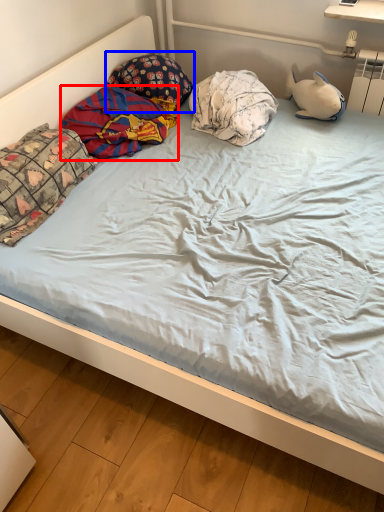
Question: Which of the following is the farthest to the observer, material (highlighted by a red box) or pillow (highlighted by a blue box)?

Choices:
 (A) material
 (B) pillow

Answer: (B)